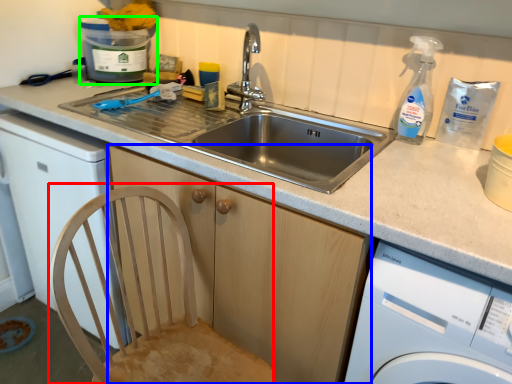
Question: Which object is positioned farthest from feeding chair (highlighted by a red box)? Select from cabinetry (highlighted by a blue box) and water cooler (highlighted by a green box).

Choices:
 (A) cabinetry
 (B) water cooler

Answer: (B)